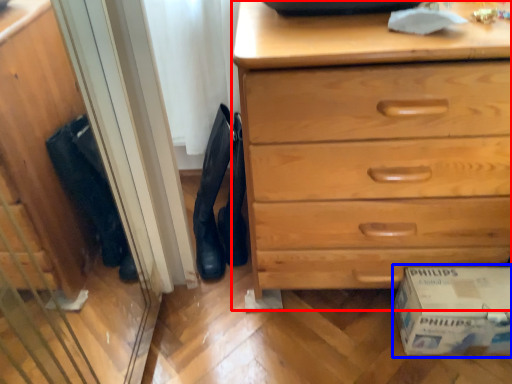
Question: Which object is closer to the camera taking this photo, chest of drawers (highlighted by a red box) or cardboard box (highlighted by a blue box)?

Choices:
 (A) chest of drawers
 (B) cardboard box

Answer: (A)